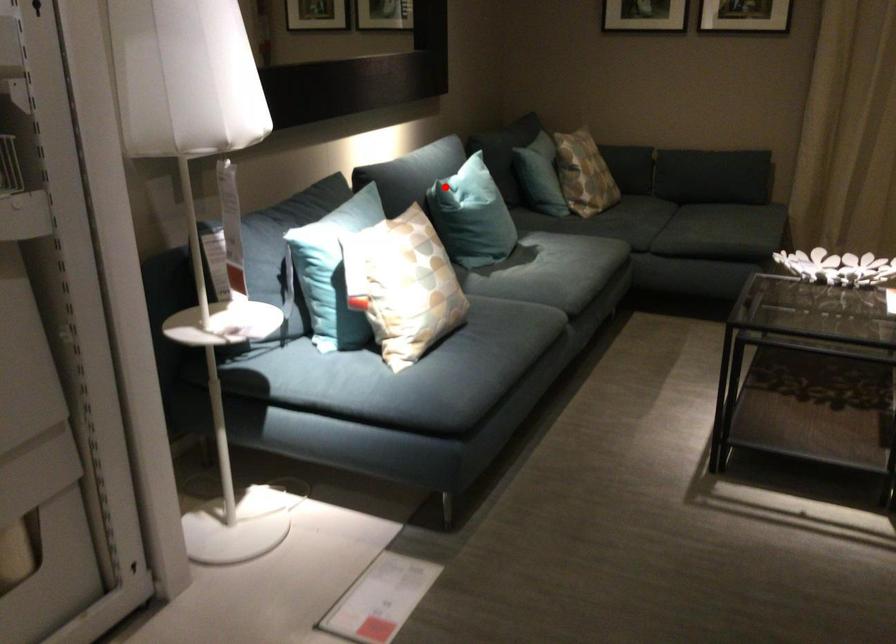
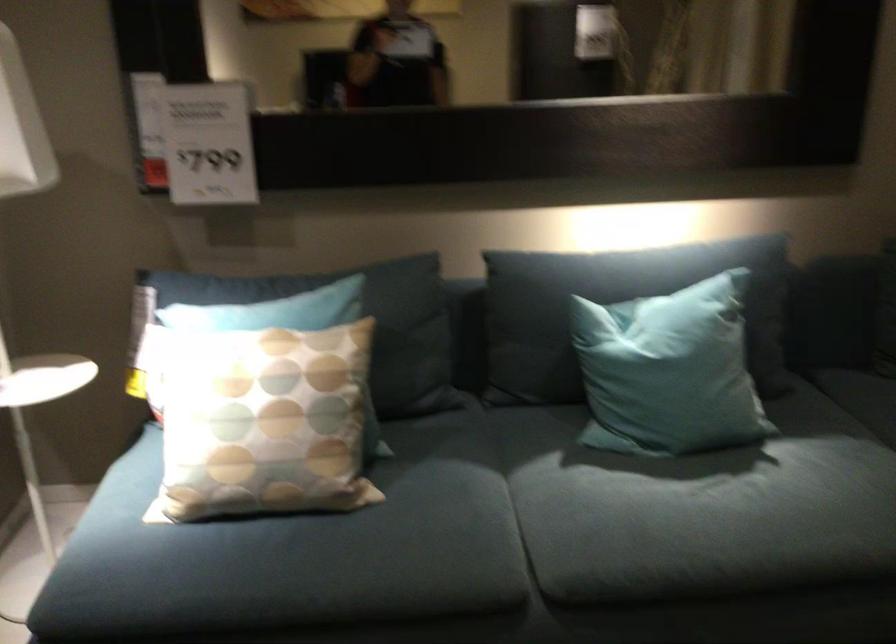
Question: I am providing you with two images of the same scene from different viewpoints. A red point is marked on the first image. At the location where the point appears in image 1, is it still visible in image 2?

Choices:
 (A) Yes
 (B) No

Answer: (A)